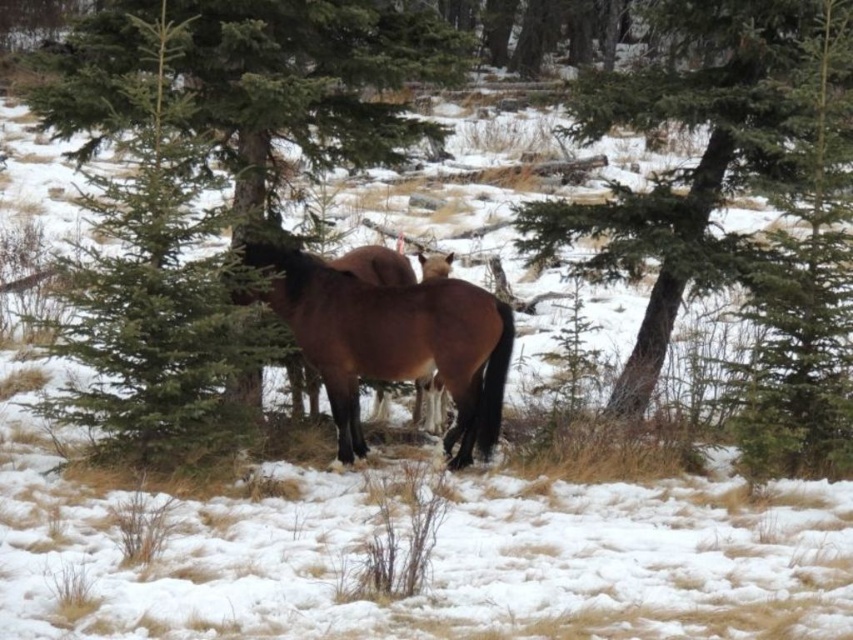
From the picture: Who is positioned more to the right, green textured tree at center or brown glossy horse at center?

green textured tree at center

Between point (564, 209) and point (459, 298), which one is positioned behind?

The point (564, 209) is behind.

In order to click on green textured tree at center in this screenshot , I will do `click(683, 168)`.

Who is more distant from viewer, [679,216] or [131,68]?

Positioned behind is point [679,216].

Does green textured tree at center appear over green textured pine tree at center?

Correct, green textured tree at center is located above green textured pine tree at center.

Identify the location of green textured tree at center. Image resolution: width=853 pixels, height=640 pixels. (683, 168).

Which is more to the right, green textured pine tree at center or brown glossy horse at center?

Positioned to the right is green textured pine tree at center.

Can you confirm if green textured pine tree at center is positioned below brown glossy horse at center?

Incorrect, green textured pine tree at center is not positioned below brown glossy horse at center.

What do you see at coordinates (310, 81) in the screenshot? I see `green textured pine tree at center` at bounding box center [310, 81].

The image size is (853, 640). What are the coordinates of `green textured pine tree at center` in the screenshot? It's located at (310, 81).